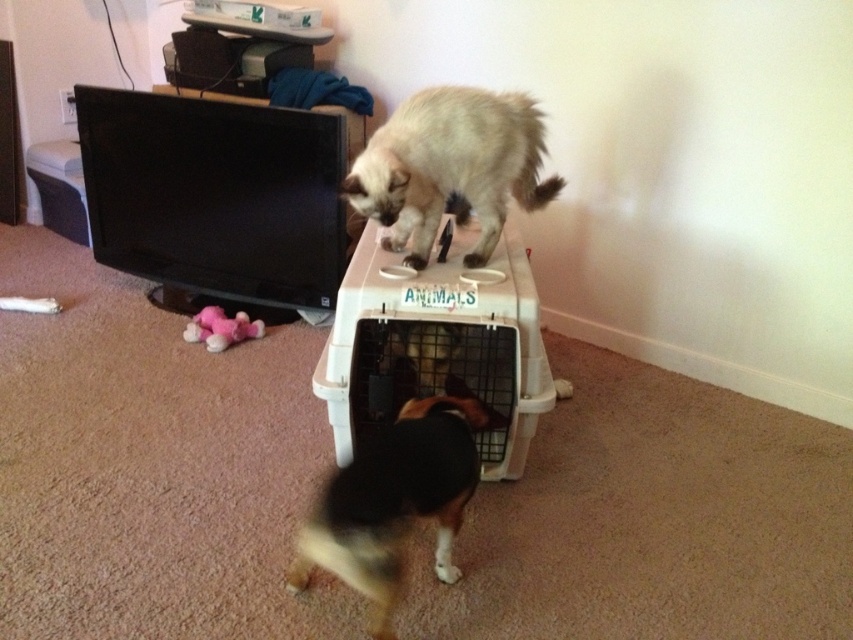
Between light brown fur at upper center and brown and white fur dog at center, which one is positioned lower?

Positioned lower is brown and white fur dog at center.

Can you confirm if light brown fur at upper center is shorter than brown and white fur dog at center?

Yes.

Does point (389, 131) come farther from viewer compared to point (456, 451)?

Yes, it is behind point (456, 451).

Where is `light brown fur at upper center`? light brown fur at upper center is located at coordinates (450, 166).

Image resolution: width=853 pixels, height=640 pixels. What do you see at coordinates (450, 166) in the screenshot?
I see `light brown fur at upper center` at bounding box center [450, 166].

Where is `light brown fur at upper center`? Image resolution: width=853 pixels, height=640 pixels. light brown fur at upper center is located at coordinates (450, 166).

Is point (440, 474) farther from viewer compared to point (212, 305)?

No, (440, 474) is in front of (212, 305).

Based on the photo, is brown and white fur dog at center thinner than pink plush toy at lower left?

No.

You are a GUI agent. You are given a task and a screenshot of the screen. Output one action in this format:
    pyautogui.click(x=<x>, y=<y>)
    Task: Click on the brown and white fur dog at center
    Image resolution: width=853 pixels, height=640 pixels.
    Given the screenshot: What is the action you would take?
    pyautogui.click(x=393, y=502)